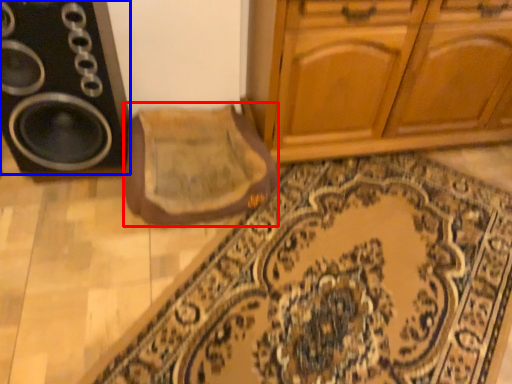
Question: Which object appears closest to the camera in this image, mat (highlighted by a red box) or speaker (highlighted by a blue box)?

Choices:
 (A) mat
 (B) speaker

Answer: (B)